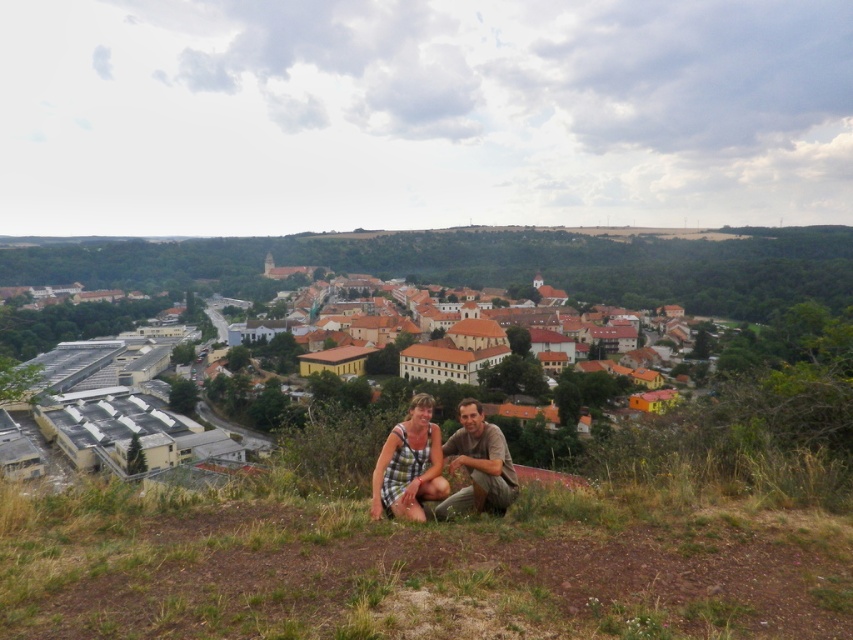
You are a drone operator tasked with capturing aerial footage of the town. Your drone has a maximum flight range of 60 meters from its starting position. If you launch the drone from where the plaid fabric couple at center are sitting, will it be able to reach the brown tiled roofs at center within its range?

The distance between the plaid fabric couple at center and the brown tiled roofs at center is 58.91 meters, which is within the drone operator s 60 meters maximum flight range. Therefore, the drone can reach the brown tiled roofs at center.

You are a photographer planning to take a landscape photo of the town. You notice the brown tiled roofs at center and the plaid fabric couple at center. Which object should you focus on first if you want to capture the most prominent feature in the foreground?

The brown tiled roofs at center should be focused on first because they are taller than the plaid fabric couple at center, making them more prominent in the foreground.